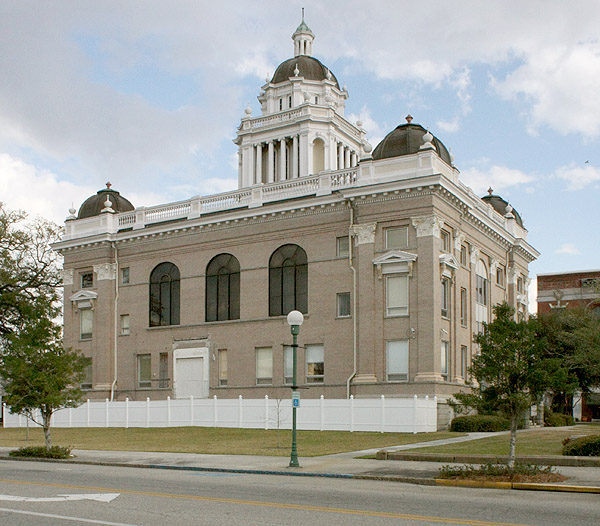
The width and height of the screenshot is (600, 526). I want to click on light globe, so click(288, 312).